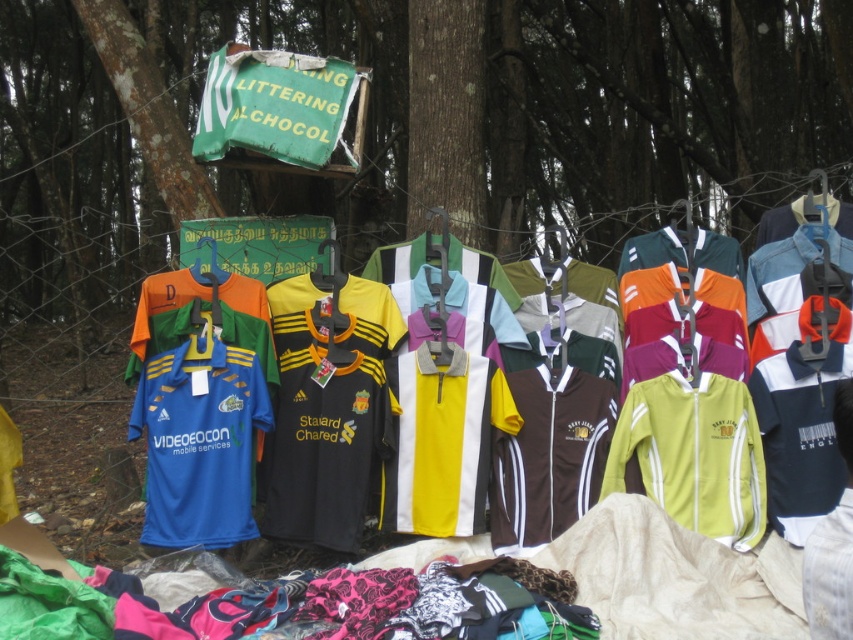
You are standing in front of the clothing rack and want to locate the smooth bark tree at center. Which direction should you look to find it?

The smooth bark tree at center is located at point coordinates of [413,128], so you should look towards the center of the image to find it.

You are a customer looking at the displayed clothing items. You see the yellow polyester jersey at center and the white fabric at center. Which one is positioned to the right?

The yellow polyester jersey at center is to the right of the white fabric at center.